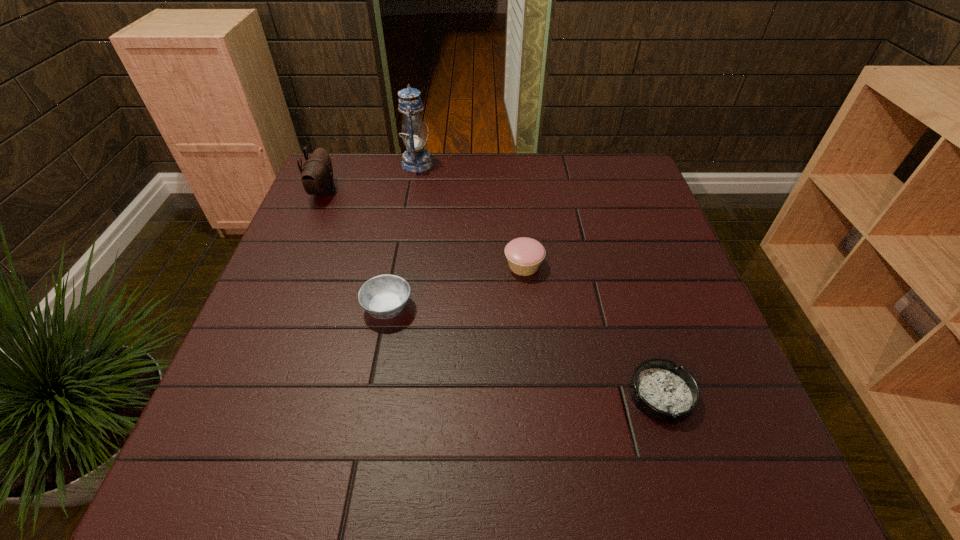
In order to click on vacant space at the far edge of the desktop in this screenshot , I will do `click(568, 178)`.

In the image, there is a desktop. Where is `blank space at the near edge`? This screenshot has width=960, height=540. blank space at the near edge is located at coordinates (628, 500).

Where is `vacant space at the left edge of the desktop`? vacant space at the left edge of the desktop is located at coordinates (271, 370).

Where is `vacant space at the right edge`? This screenshot has height=540, width=960. vacant space at the right edge is located at coordinates pyautogui.click(x=702, y=377).

This screenshot has height=540, width=960. What are the coordinates of `free region at the far left corner of the desktop` in the screenshot? It's located at (339, 173).

Where is `free space at the far right corner of the desktop`? The width and height of the screenshot is (960, 540). free space at the far right corner of the desktop is located at coordinates (623, 190).

The width and height of the screenshot is (960, 540). Find the location of `empty space that is in between the tallest object and the fourth object from left to right`. empty space that is in between the tallest object and the fourth object from left to right is located at coordinates (470, 215).

Identify the location of free point between the nearer ashtray and the tallest object. The width and height of the screenshot is (960, 540). (540, 279).

At what (x,y) coordinates should I click in order to perform the action: click on free area in between the leftmost object and the lantern. Please return your answer as a coordinate pair (x, y). Looking at the image, I should click on (371, 178).

Identify the location of vacant area that lies between the farthest object and the cupcake. (470, 215).